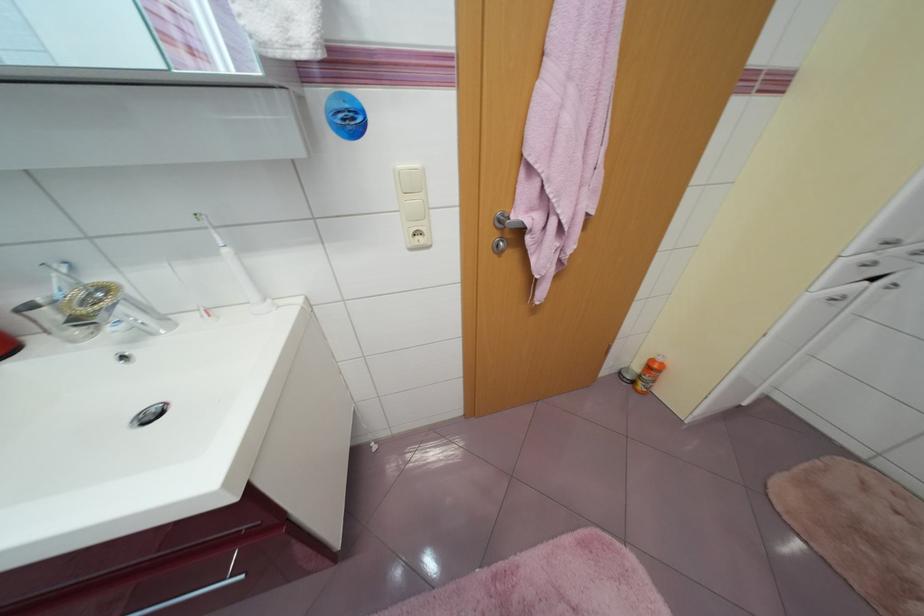
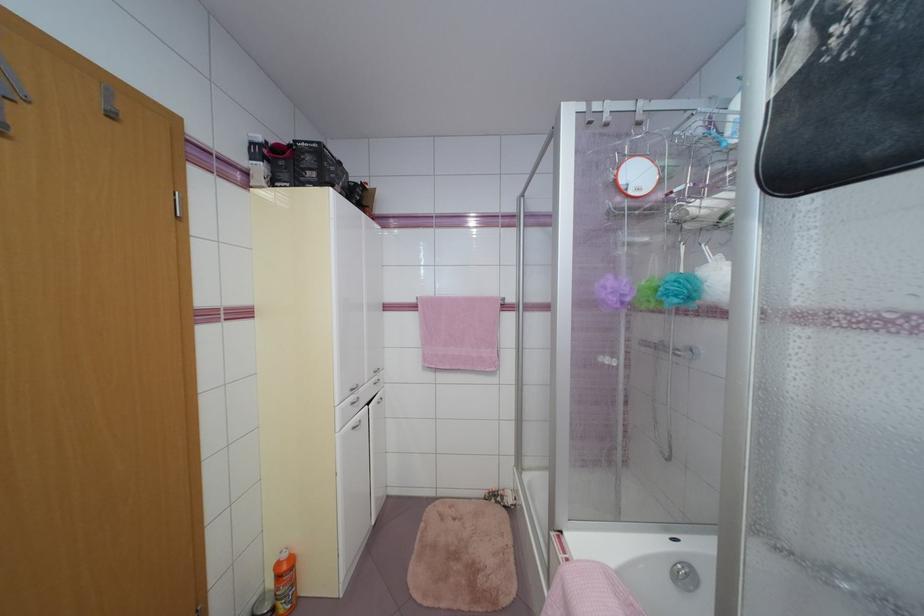
The point at (645,387) is marked in the first image. Where is the corresponding point in the second image?

(287, 610)